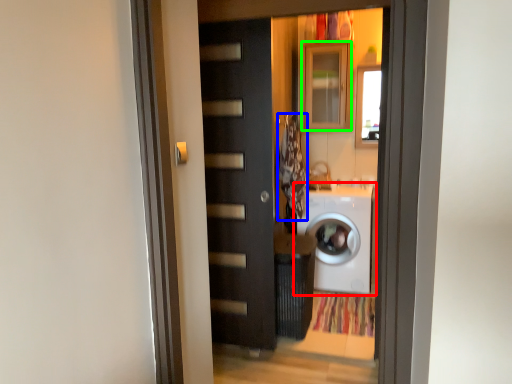
Question: Which is nearer to the washing machine (highlighted by a red box)? laundry (highlighted by a blue box) or cabinetry (highlighted by a green box).

Choices:
 (A) laundry
 (B) cabinetry

Answer: (A)